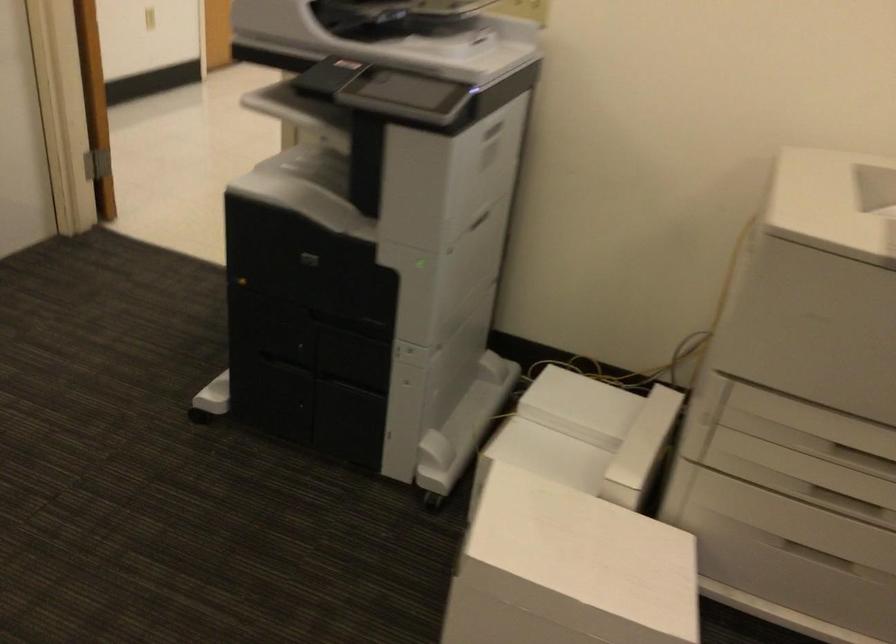
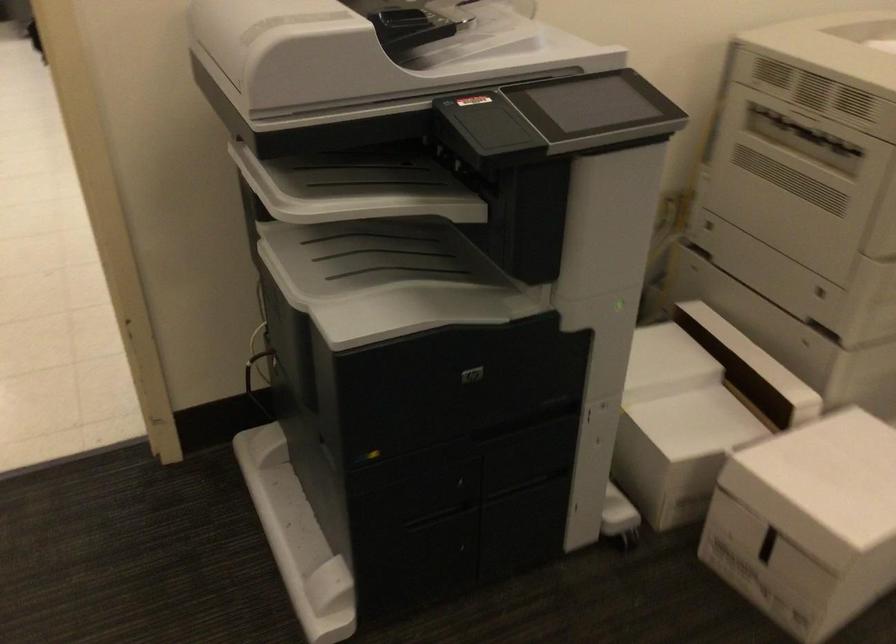
In the second image, find the point that corresponds to (x=298, y=102) in the first image.

(354, 187)